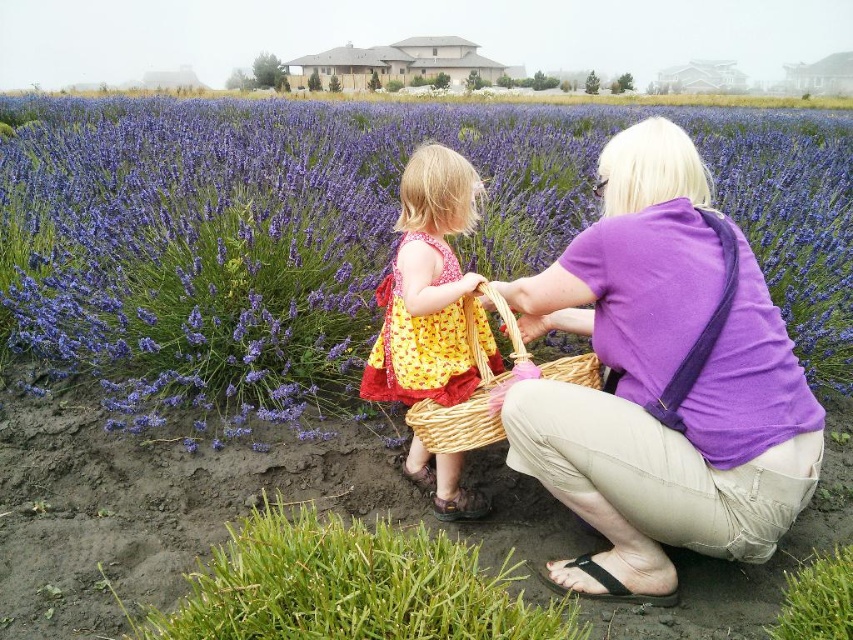
You are a painter standing in the lavender field and you need to decide which item to place in your painting first. Based on the sizes of the purple cotton shirt at center and the woven straw basket at center, which one should you paint first if you want to start with the larger object?

The purple cotton shirt at center has a larger width than the woven straw basket at center, so you should paint the purple cotton shirt at center first since it is bigger.

You are a photographer trying to capture a closeup of the woven straw basket at center while ensuring the purple cotton shirt at center is still visible in the frame. Given their sizes, which object should you focus on first to ensure both are in the shot?

The purple cotton shirt at center is larger than the woven straw basket at center, so focusing on the purple cotton shirt at center first will help ensure both objects remain in the frame.

You are standing in the lavender field and see the purple cotton shirt at center and the woven straw basket at center. Which object is taller?

The purple cotton shirt at center is taller than the woven straw basket at center.